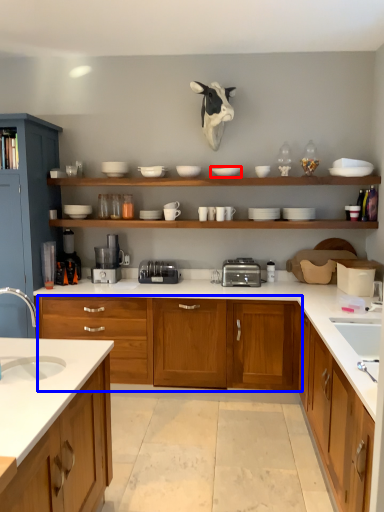
Question: Which point is closer to the camera, tableware (highlighted by a red box) or cabinetry (highlighted by a blue box)?

Choices:
 (A) tableware
 (B) cabinetry

Answer: (B)